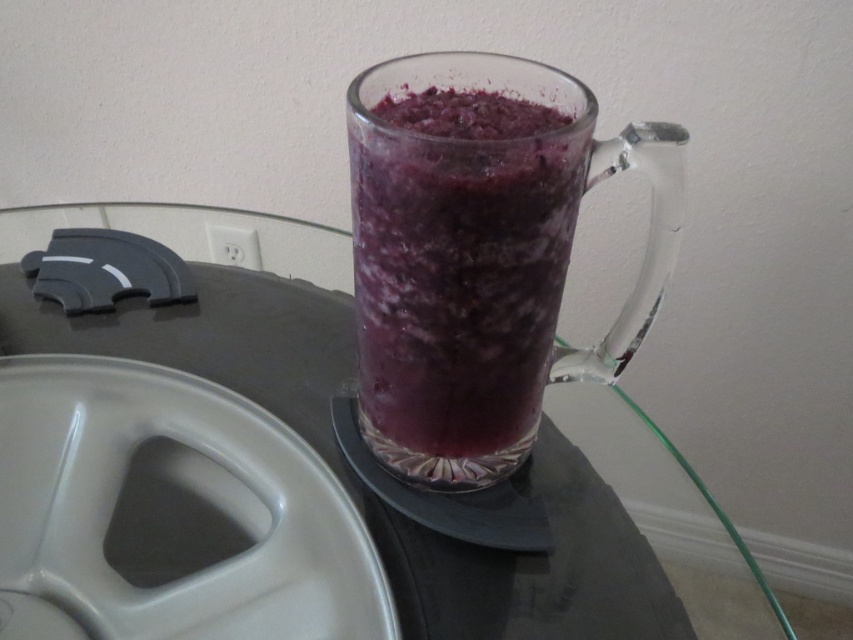
Does purple translucent glass at center have a lesser width compared to transparent glass table at center?

Yes, purple translucent glass at center is thinner than transparent glass table at center.

Is point (366, 324) less distant than point (741, 589)?

Yes, point (366, 324) is closer to viewer.

Locate an element on the screen. purple translucent glass at center is located at coordinates (459, 268).